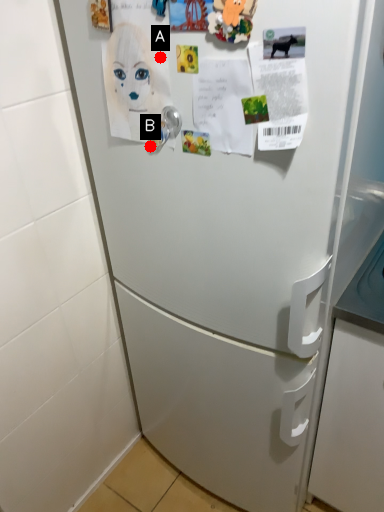
Question: Two points are circled on the image, labeled by A and B beside each circle. Which point appears farthest from the camera in this image?

Choices:
 (A) A is further
 (B) B is further

Answer: (B)